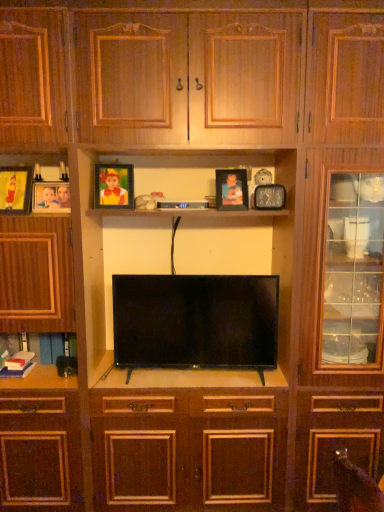
Describe the element at coordinates (195, 321) in the screenshot. Image resolution: width=384 pixels, height=512 pixels. I see `flat screen tv at center` at that location.

I want to click on matte wooden picture frame at left, arranged as the 1th picture frame when viewed from the left, so click(15, 190).

Image resolution: width=384 pixels, height=512 pixels. In order to click on flat screen tv at center in this screenshot , I will do `click(195, 321)`.

In terms of height, does matte wooden picture frame at left, arranged as the 1th picture frame when viewed from the left, look taller or shorter compared to matte black picture frame at upper center, arranged as the fourth picture frame when viewed from the left?

Clearly, matte wooden picture frame at left, arranged as the 1th picture frame when viewed from the left, is taller compared to matte black picture frame at upper center, arranged as the fourth picture frame when viewed from the left.

Is matte wooden picture frame at left, arranged as the 1th picture frame when viewed from the left, thinner than matte black picture frame at upper center, the second picture frame viewed from the right?

In fact, matte wooden picture frame at left, arranged as the 1th picture frame when viewed from the left, might be wider than matte black picture frame at upper center, the second picture frame viewed from the right.

From the image's perspective, who appears lower, matte wooden picture frame at left, which is the fifth picture frame in right-to-left order, or matte black picture frame at upper center, arranged as the fourth picture frame when viewed from the left?

matte wooden picture frame at left, which is the fifth picture frame in right-to-left order, appears lower in the image.

Is matte wooden picture frame at left, which is counted as the 4th picture frame, starting from the right, in front of or behind flat screen tv at center in the image?

Visually, matte wooden picture frame at left, which is counted as the 4th picture frame, starting from the right, is located behind flat screen tv at center.

Where is `television below the matte wooden picture frame at left, the 2th picture frame in the left-to-right sequence (from the image's perspective)`? television below the matte wooden picture frame at left, the 2th picture frame in the left-to-right sequence (from the image's perspective) is located at coordinates (195, 321).

Can you confirm if matte wooden picture frame at left, the 2th picture frame in the left-to-right sequence, is bigger than flat screen tv at center?

Actually, matte wooden picture frame at left, the 2th picture frame in the left-to-right sequence, might be smaller than flat screen tv at center.

In the scene shown: Between matte black picture frame at upper center, the second picture frame viewed from the right, and matte wooden picture frame at left, which is the fifth picture frame in right-to-left order, which one has smaller width?

Thinner between the two is matte black picture frame at upper center, the second picture frame viewed from the right.

Can you confirm if matte black picture frame at upper center, the second picture frame viewed from the right, is positioned to the right of matte wooden picture frame at left, which is the fifth picture frame in right-to-left order?

Correct, you'll find matte black picture frame at upper center, the second picture frame viewed from the right, to the right of matte wooden picture frame at left, which is the fifth picture frame in right-to-left order.

Is matte black picture frame at upper center, arranged as the fourth picture frame when viewed from the left, aimed at matte wooden picture frame at left, which is the fifth picture frame in right-to-left order?

No, matte black picture frame at upper center, arranged as the fourth picture frame when viewed from the left, is not oriented towards matte wooden picture frame at left, which is the fifth picture frame in right-to-left order.

Would you say matte black picture frame at upper center, arranged as the fourth picture frame when viewed from the left, contains matte wooden picture frame at left, arranged as the 1th picture frame when viewed from the left?

That's incorrect, matte wooden picture frame at left, arranged as the 1th picture frame when viewed from the left, is not inside matte black picture frame at upper center, arranged as the fourth picture frame when viewed from the left.

From a real-world perspective, between matte black picture frame at upper center, arranged as the fourth picture frame when viewed from the left, and black plastic remote control at center, who is vertically higher?

In real-world perspective, matte black picture frame at upper center, arranged as the fourth picture frame when viewed from the left, is above.

In the scene shown: Considering the positions of objects matte black picture frame at upper center, the second picture frame viewed from the right, and black plastic remote control at center in the image provided, who is in front, matte black picture frame at upper center, the second picture frame viewed from the right, or black plastic remote control at center?

black plastic remote control at center is in front.

Is matte black picture frame at upper center, arranged as the fourth picture frame when viewed from the left, looking in the opposite direction of black plastic remote control at center?

matte black picture frame at upper center, arranged as the fourth picture frame when viewed from the left, is not turned away from black plastic remote control at center.

Which is in front, point (217, 193) or point (161, 202)?

Positioned in front is point (161, 202).

From a real-world perspective, starting from the matte gold picture frame at upper left, which is counted as the third picture frame, starting from the left, which picture frame is the 4th one below it? Please provide its 2D coordinates.

[(51, 197)]

From the image's perspective, which is above, matte gold picture frame at upper left, which is counted as the third picture frame, starting from the left, or matte wooden picture frame at left, the 2th picture frame in the left-to-right sequence?

matte gold picture frame at upper left, which is counted as the third picture frame, starting from the left, appears higher in the image.

How different are the orientations of matte gold picture frame at upper left, which is counted as the third picture frame, starting from the left, and matte wooden picture frame at left, which is counted as the 4th picture frame, starting from the right, in degrees?

The angle between the facing direction of matte gold picture frame at upper left, which is counted as the third picture frame, starting from the left, and the facing direction of matte wooden picture frame at left, which is counted as the 4th picture frame, starting from the right, is 0.89 degrees.

Between point (97, 186) and point (48, 197), which one is positioned behind?

Point (97, 186)

Measure the distance from matte wooden picture frame at left, the 2th picture frame in the left-to-right sequence, to matte black picture frame at upper center, arranged as the fourth picture frame when viewed from the left.

matte wooden picture frame at left, the 2th picture frame in the left-to-right sequence, and matte black picture frame at upper center, arranged as the fourth picture frame when viewed from the left, are 27.47 inches apart.

Find the location of a particular element. the 3rd picture frame above the matte wooden picture frame at left, which is counted as the 4th picture frame, starting from the right (from the image's perspective) is located at coordinates (231, 189).

What's the angular difference between matte wooden picture frame at left, which is counted as the 4th picture frame, starting from the right, and matte black picture frame at upper center, the second picture frame viewed from the right,'s facing directions?

6.83 degrees.

Considering the sizes of matte wooden picture frame at left, which is counted as the 4th picture frame, starting from the right, and matte black picture frame at upper center, arranged as the fourth picture frame when viewed from the left, in the image, is matte wooden picture frame at left, which is counted as the 4th picture frame, starting from the right, taller or shorter than matte black picture frame at upper center, arranged as the fourth picture frame when viewed from the left,?

matte wooden picture frame at left, which is counted as the 4th picture frame, starting from the right, is shorter than matte black picture frame at upper center, arranged as the fourth picture frame when viewed from the left.

Would you say matte gold picture frame at upper left, which is counted as the third picture frame, starting from the left, is part of matte black picture frame at upper center, arranged as the fourth picture frame when viewed from the left,'s contents?

No, matte gold picture frame at upper left, which is counted as the third picture frame, starting from the left, is located outside of matte black picture frame at upper center, arranged as the fourth picture frame when viewed from the left.

Is matte black picture frame at upper center, arranged as the fourth picture frame when viewed from the left, looking in the opposite direction of matte gold picture frame at upper left, which is counted as the third picture frame, starting from the left?

That's not correct — matte black picture frame at upper center, arranged as the fourth picture frame when viewed from the left, is not looking away from matte gold picture frame at upper left, which is counted as the third picture frame, starting from the left.

Is matte black picture frame at upper center, the second picture frame viewed from the right, taller or shorter than matte gold picture frame at upper left, which ranks as the 3th picture frame in right-to-left order?

Clearly, matte black picture frame at upper center, the second picture frame viewed from the right, is shorter compared to matte gold picture frame at upper left, which ranks as the 3th picture frame in right-to-left order.

Considering their positions, is matte black picture frame at upper center, arranged as the fourth picture frame when viewed from the left, located in front of or behind matte gold picture frame at upper left, which ranks as the 3th picture frame in right-to-left order?

Clearly, matte black picture frame at upper center, arranged as the fourth picture frame when viewed from the left, is behind matte gold picture frame at upper left, which ranks as the 3th picture frame in right-to-left order.

The height and width of the screenshot is (512, 384). I want to click on the 4th picture frame behind the matte wooden picture frame at left, arranged as the 1th picture frame when viewed from the left, so click(x=231, y=189).

At what (x,y) coordinates should I click in order to perform the action: click on television beneath the matte wooden picture frame at left, the 2th picture frame in the left-to-right sequence (from a real-world perspective). Please return your answer as a coordinate pair (x, y). This screenshot has height=512, width=384. Looking at the image, I should click on (195, 321).

When comparing their distances from matte black picture frame at upper center, arranged as the fourth picture frame when viewed from the left, does matte black clock at upper center, the fifth picture frame in the left-to-right sequence, or matte wooden picture frame at left, which is counted as the 4th picture frame, starting from the right, seem further?

matte wooden picture frame at left, which is counted as the 4th picture frame, starting from the right.

From the picture: Looking at the image, which one is located further to matte gold picture frame at upper left, which ranks as the 3th picture frame in right-to-left order, flat screen tv at center or matte black picture frame at upper center, arranged as the fourth picture frame when viewed from the left?

flat screen tv at center is positioned further to the anchor matte gold picture frame at upper left, which ranks as the 3th picture frame in right-to-left order.

Based on their spatial positions, is matte black clock at upper center, which is counted as the first picture frame, starting from the right, or flat screen tv at center closer to matte black picture frame at upper center, arranged as the fourth picture frame when viewed from the left?

The object closer to matte black picture frame at upper center, arranged as the fourth picture frame when viewed from the left, is matte black clock at upper center, which is counted as the first picture frame, starting from the right.

Considering their positions, is matte gold picture frame at upper left, which ranks as the 3th picture frame in right-to-left order, positioned closer to matte black clock at upper center, which is counted as the first picture frame, starting from the right, than matte black picture frame at upper center, arranged as the fourth picture frame when viewed from the left?

matte black picture frame at upper center, arranged as the fourth picture frame when viewed from the left, is closer to matte black clock at upper center, which is counted as the first picture frame, starting from the right.

Estimate the real-world distances between objects in this image. Which object is closer to matte black clock at upper center, the fifth picture frame in the left-to-right sequence, black plastic remote control at center or matte wooden picture frame at left, which is counted as the 4th picture frame, starting from the right?

black plastic remote control at center is closer to matte black clock at upper center, the fifth picture frame in the left-to-right sequence.

Looking at the image, which one is located closer to matte black clock at upper center, which is counted as the first picture frame, starting from the right, black plastic remote control at center or matte wooden picture frame at left, arranged as the 1th picture frame when viewed from the left?

black plastic remote control at center is positioned closer to the anchor matte black clock at upper center, which is counted as the first picture frame, starting from the right.

From the picture: From the image, which object appears to be farther from black plastic remote control at center, matte black clock at upper center, the fifth picture frame in the left-to-right sequence, or flat screen tv at center?

flat screen tv at center is further to black plastic remote control at center.

From the image, which object appears to be nearer to flat screen tv at center, matte gold picture frame at upper left, which is counted as the third picture frame, starting from the left, or matte black clock at upper center, the fifth picture frame in the left-to-right sequence?

matte black clock at upper center, the fifth picture frame in the left-to-right sequence.

The width and height of the screenshot is (384, 512). I want to click on appliance located between matte wooden picture frame at left, which is the fifth picture frame in right-to-left order, and matte black picture frame at upper center, the second picture frame viewed from the right, in the left-right direction, so click(x=183, y=204).

The width and height of the screenshot is (384, 512). I want to click on picture frame between matte wooden picture frame at left, which is counted as the 4th picture frame, starting from the right, and matte black picture frame at upper center, the second picture frame viewed from the right, so click(x=113, y=186).

Where is `appliance between matte gold picture frame at upper left, which is counted as the third picture frame, starting from the left, and matte black picture frame at upper center, the second picture frame viewed from the right`? Image resolution: width=384 pixels, height=512 pixels. appliance between matte gold picture frame at upper left, which is counted as the third picture frame, starting from the left, and matte black picture frame at upper center, the second picture frame viewed from the right is located at coordinates (183, 204).

Locate an element on the screen. The image size is (384, 512). appliance situated between matte gold picture frame at upper left, which is counted as the third picture frame, starting from the left, and matte black clock at upper center, which is counted as the first picture frame, starting from the right, from left to right is located at coordinates (183, 204).